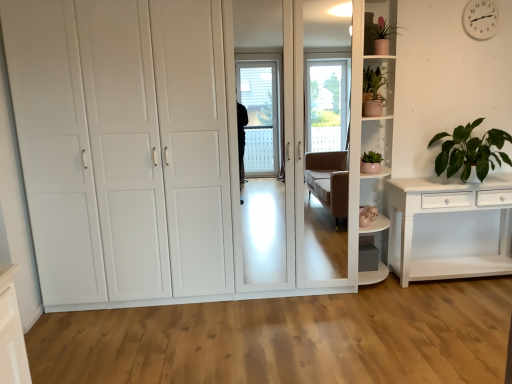
What are the coordinates of `vacant space in front of white glossy shelf at upper right, the first shelf positioned from the bottom` in the screenshot? It's located at (385, 303).